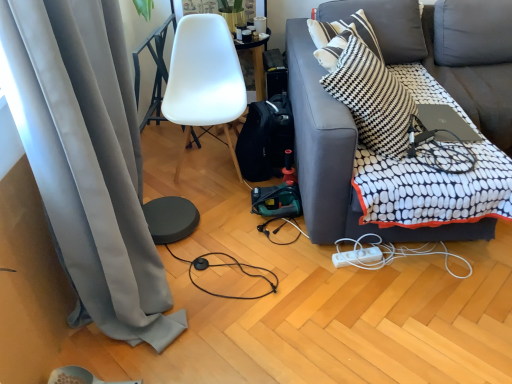
Where is `free space to the left of white plastic power outlet at lower center`? This screenshot has width=512, height=384. free space to the left of white plastic power outlet at lower center is located at coordinates (320, 265).